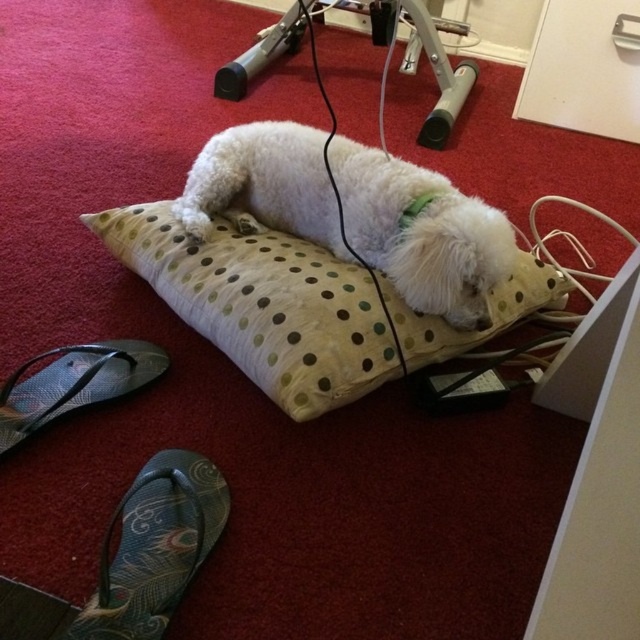
You are standing in the room and want to pick up an object. Which of the two points, point (128, 541) or point (20, 394), is closer to you?

Point (128, 541) is closer to the viewer than point (20, 394).

You are a dog owner who wants to place a small toy between the green fabric sandal at lower left and the textured fabric sandal at lower left. Which sandal should you place the toy closer to if you want it near the smaller one?

The green fabric sandal at lower left has a smaller size compared to the textured fabric sandal at lower left, so you should place the toy closer to the green fabric sandal at lower left.

You are a photographer setting up a camera at the same level as the green fabric sandal at lower left. When you look through the camera lens, will the white fluffy dog at center appear taller than the sandal?

The white fluffy dog at center has a greater height compared to the green fabric sandal at lower left, so yes, the dog will appear taller than the sandal when viewed from the camera positioned at the sandal level.